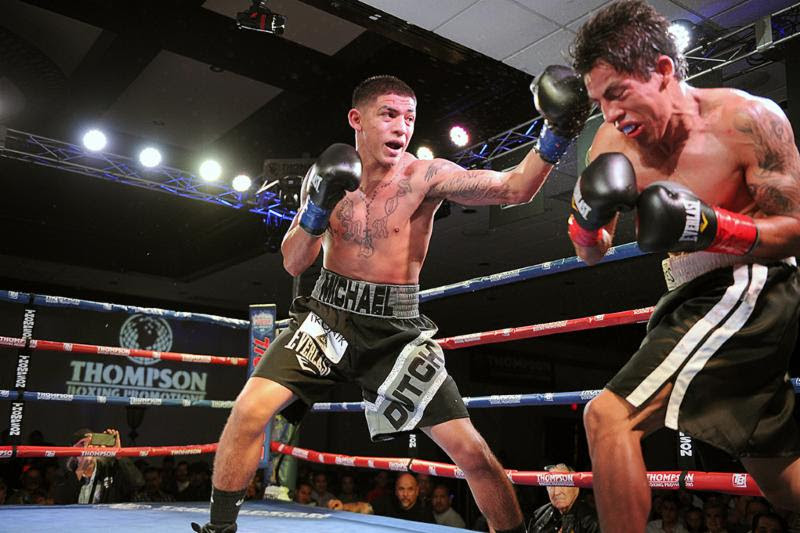
Locate an element on the screen. gray rafters is located at coordinates (508, 149), (70, 164).